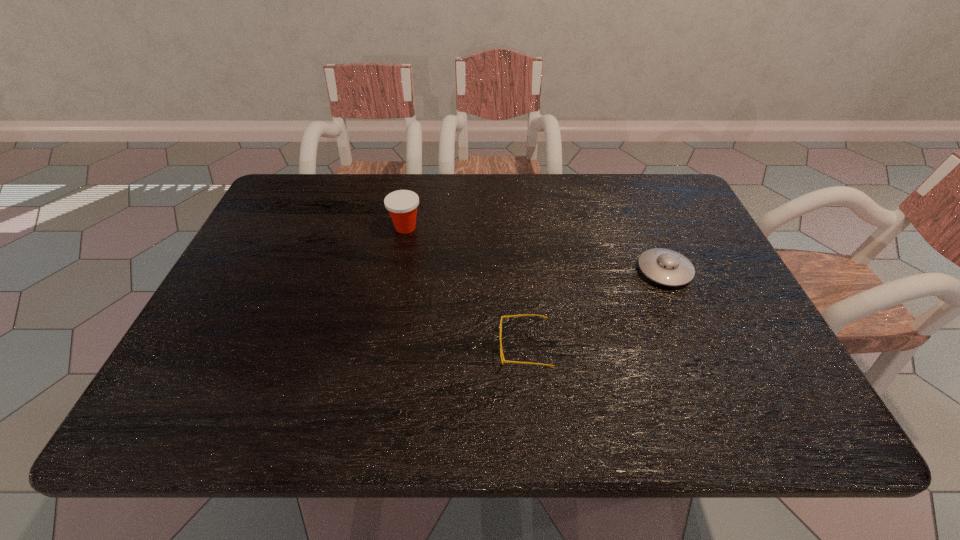
Find the location of a particular element. blank area located 0.380m in front of the lenses of the second object from right to left is located at coordinates (321, 348).

Find the location of `object that is at the far edge`. object that is at the far edge is located at coordinates (402, 205).

This screenshot has width=960, height=540. I want to click on object at the right edge, so click(666, 267).

The width and height of the screenshot is (960, 540). Identify the location of free space at the far edge. (566, 219).

Where is `vacant space at the near edge of the desktop`? vacant space at the near edge of the desktop is located at coordinates (389, 415).

Locate an element on the screen. The image size is (960, 540). vacant space at the left edge of the desktop is located at coordinates coord(259,322).

The width and height of the screenshot is (960, 540). In the image, there is a desktop. In order to click on vacant area at the right edge in this screenshot , I will do `click(695, 230)`.

Find the location of a particular element. Image resolution: width=960 pixels, height=540 pixels. free space at the far right corner is located at coordinates (638, 190).

Where is `vacant area between the rightmost object and the tallest object`? vacant area between the rightmost object and the tallest object is located at coordinates (535, 249).

Where is `unoccupied position between the saucer and the second object from left to right`? unoccupied position between the saucer and the second object from left to right is located at coordinates click(594, 309).